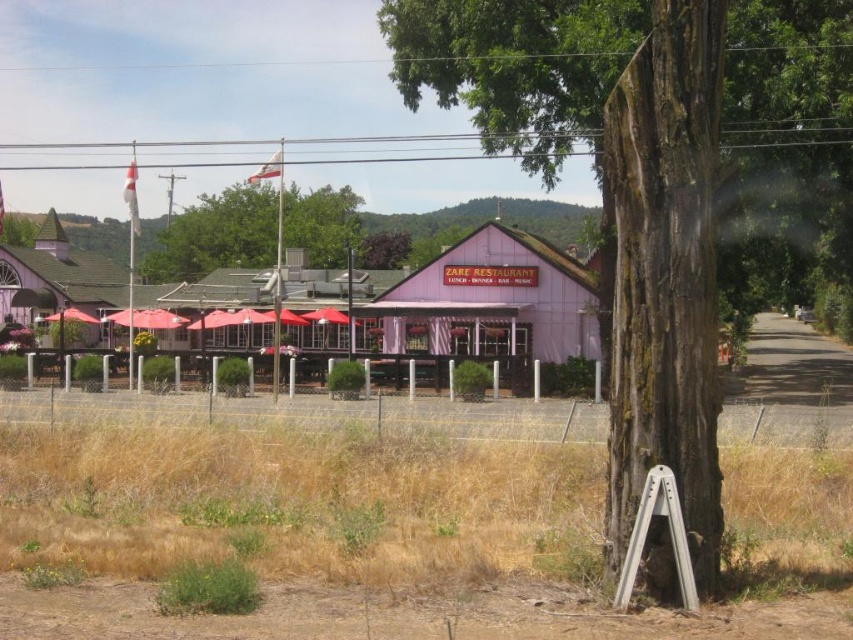
Which of these two, green leafy tree at upper center or matte white tent at left, stands taller?

matte white tent at left is taller.

Who is positioned more to the right, green leafy tree at upper center or matte white tent at left?

Positioned to the right is green leafy tree at upper center.

Between point (256, 195) and point (48, 269), which one is positioned behind?

The point (256, 195) is more distant.

Where is `green leafy tree at upper center`? green leafy tree at upper center is located at coordinates (216, 236).

Which of these two, purple wood zare restaurant at center or green leafy tree at upper center, stands shorter?

purple wood zare restaurant at center is shorter.

Who is positioned more to the left, purple wood zare restaurant at center or green leafy tree at upper center?

green leafy tree at upper center

The image size is (853, 640). Identify the location of purple wood zare restaurant at center. (492, 301).

Does pink wooden restaurant at center have a lesser height compared to matte white tent at left?

In fact, pink wooden restaurant at center may be taller than matte white tent at left.

How much distance is there between pink wooden restaurant at center and matte white tent at left?

They are 6.75 meters apart.

You are a GUI agent. You are given a task and a screenshot of the screen. Output one action in this format:
    pyautogui.click(x=<x>, y=<y>)
    Task: Click on the pink wooden restaurant at center
    The width and height of the screenshot is (853, 640).
    Given the screenshot: What is the action you would take?
    pyautogui.click(x=482, y=301)